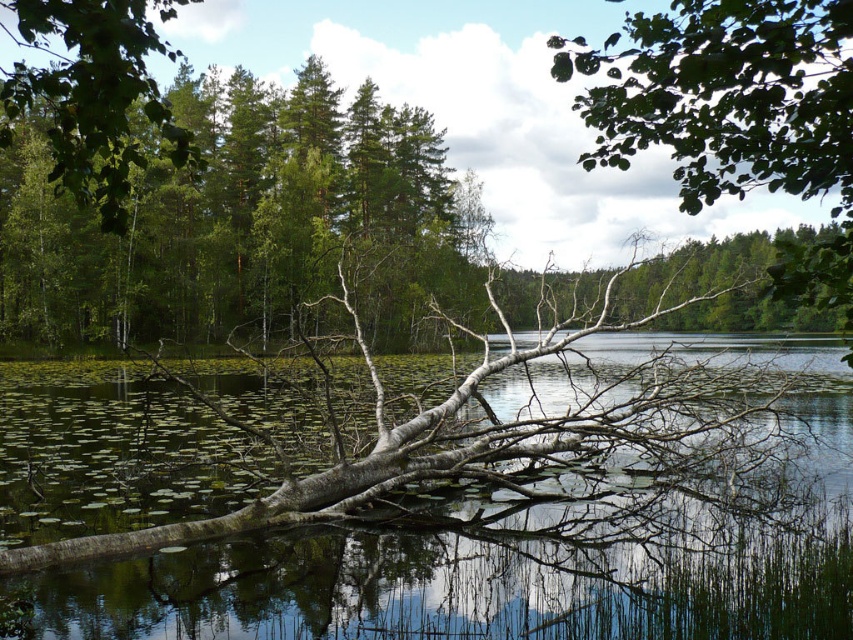
You are a GUI agent. You are given a task and a screenshot of the screen. Output one action in this format:
    pyautogui.click(x=<x>, y=<y>)
    Task: Click on the transparent water at center
    The height and width of the screenshot is (640, 853).
    Given the screenshot: What is the action you would take?
    pyautogui.click(x=538, y=536)

Can you confirm if transparent water at center is positioned to the left of green matte tree at upper left?

In fact, transparent water at center is to the right of green matte tree at upper left.

Between point (59, 605) and point (209, 144), which one is positioned behind?

Positioned behind is point (209, 144).

This screenshot has width=853, height=640. In order to click on transparent water at center in this screenshot , I will do `click(538, 536)`.